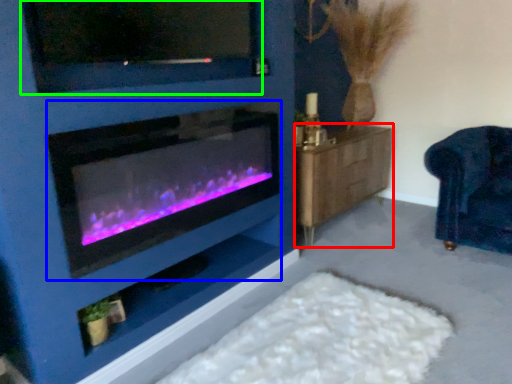
Question: Considering the real-world distances, which object is closest to dresser (highlighted by a red box)? wood burning stove (highlighted by a blue box) or tv show (highlighted by a green box).

Choices:
 (A) wood burning stove
 (B) tv show

Answer: (A)